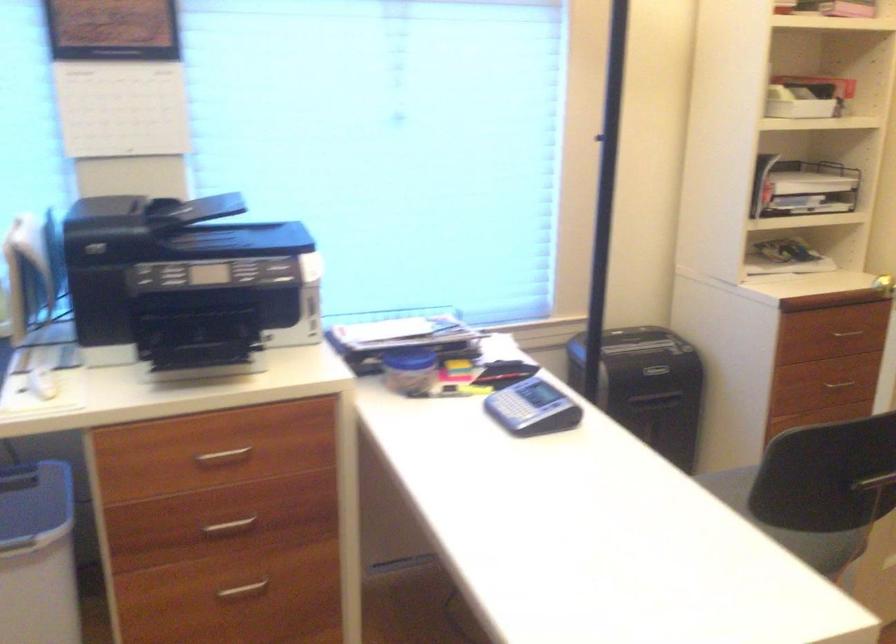
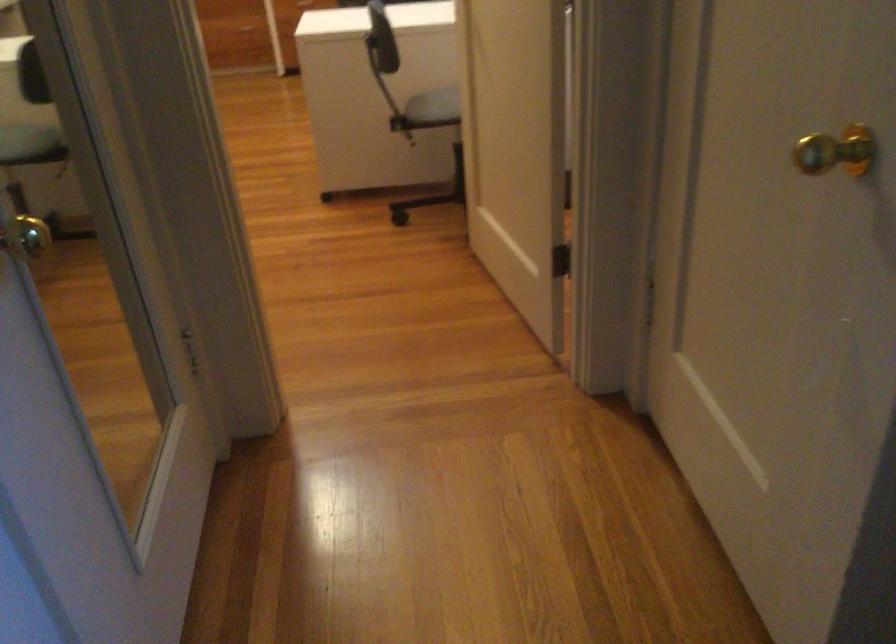
Find the pixel in the second image that matches (x=815, y=536) in the first image.

(434, 106)